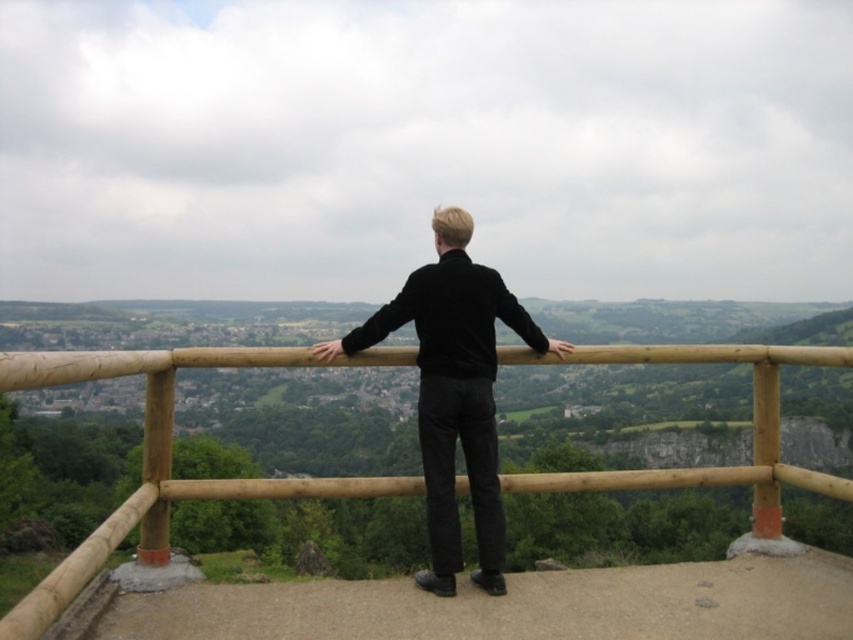
Between point (177, 353) and point (479, 417), which one is positioned behind?

Positioned behind is point (479, 417).

Who is positioned more to the right, brown wooden rail at center or black velvet sweater at center?

black velvet sweater at center is more to the right.

The width and height of the screenshot is (853, 640). In order to click on brown wooden rail at center in this screenshot , I will do `click(167, 458)`.